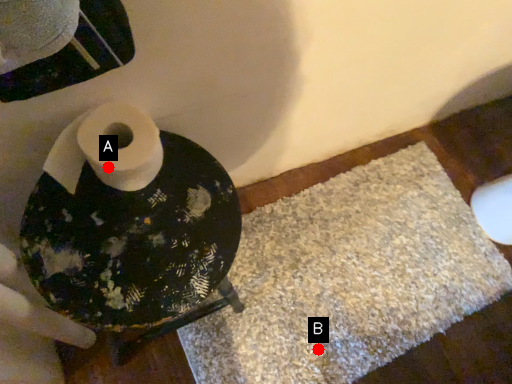
Question: Two points are circled on the image, labeled by A and B beside each circle. Among these points, which one is nearest to the camera?

Choices:
 (A) A is closer
 (B) B is closer

Answer: (A)